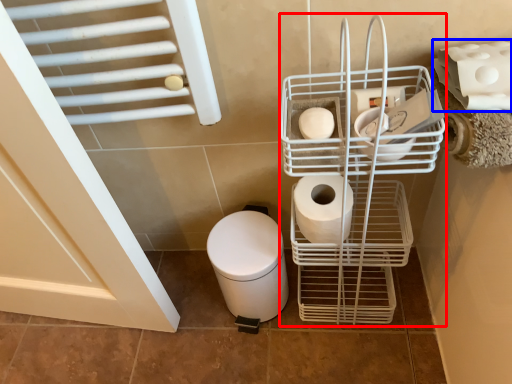
Question: Among these objects, which one is farthest to the camera, shopping cart (highlighted by a red box) or toilet paper (highlighted by a blue box)?

Choices:
 (A) shopping cart
 (B) toilet paper

Answer: (B)